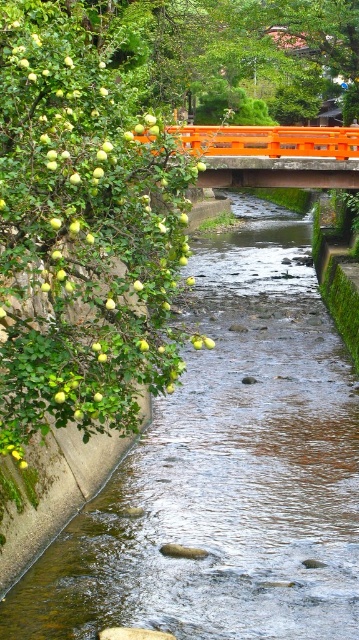
Is clear water at stream center above orange painted wooden bridge at center?

No, clear water at stream center is not above orange painted wooden bridge at center.

Which is above, clear water at stream center or orange painted wooden bridge at center?

Positioned higher is orange painted wooden bridge at center.

This screenshot has height=640, width=359. Identify the location of clear water at stream center. (226, 470).